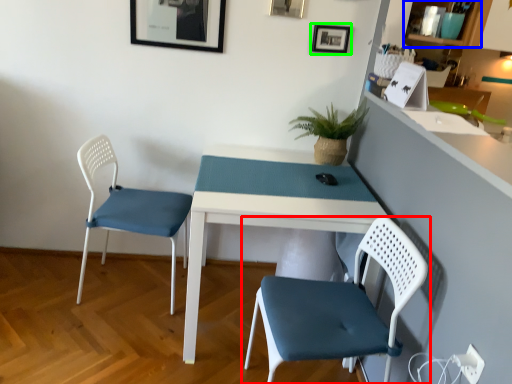
Question: Which object is positioned farthest from chair (highlighted by a red box)? Select from shelf (highlighted by a blue box) and picture frame (highlighted by a green box).

Choices:
 (A) shelf
 (B) picture frame

Answer: (A)